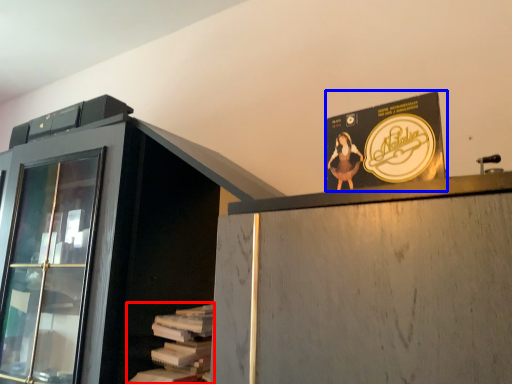
Question: Which of the following is the closest to the observer, book (highlighted by a red box) or advertisement (highlighted by a blue box)?

Choices:
 (A) book
 (B) advertisement

Answer: (B)